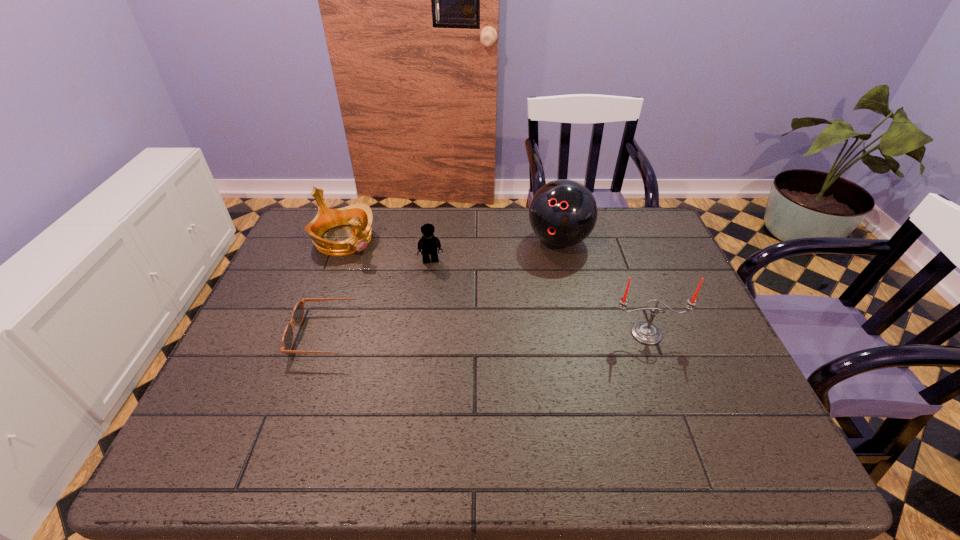
Image resolution: width=960 pixels, height=540 pixels. Find the location of `vacant space that's between the sunglasses and the bowling ball`. vacant space that's between the sunglasses and the bowling ball is located at coordinates (445, 288).

This screenshot has height=540, width=960. I want to click on free space between the Lego and the candle, so [539, 298].

Locate an element on the screen. Image resolution: width=960 pixels, height=540 pixels. blank region between the tiara and the candle is located at coordinates (495, 286).

At what (x,y) coordinates should I click in order to perform the action: click on free space between the bowling ball and the sunglasses. Please return your answer as a coordinate pair (x, y). This screenshot has width=960, height=540. Looking at the image, I should click on (445, 288).

Where is `free point between the candle and the bowling ball`? Image resolution: width=960 pixels, height=540 pixels. free point between the candle and the bowling ball is located at coordinates (603, 287).

At what (x,y) coordinates should I click in order to perform the action: click on vacant space that's between the candle and the sunglasses. Please return your answer as a coordinate pair (x, y). The width and height of the screenshot is (960, 540). Looking at the image, I should click on (489, 334).

The image size is (960, 540). I want to click on vacant area that lies between the candle and the bowling ball, so click(603, 287).

Where is `free point between the shortest object and the Lego`? The width and height of the screenshot is (960, 540). free point between the shortest object and the Lego is located at coordinates (382, 298).

Identify which object is located as the nearest to the bowling ball. Please provide its 2D coordinates. Your answer should be formatted as a tuple, i.e. [(x, y)], where the tuple contains the x and y coordinates of a point satisfying the conditions above.

[(646, 333)]

Identify which object is the fourth nearest to the third object from left to right. Please provide its 2D coordinates. Your answer should be formatted as a tuple, i.e. [(x, y)], where the tuple contains the x and y coordinates of a point satisfying the conditions above.

[(646, 333)]